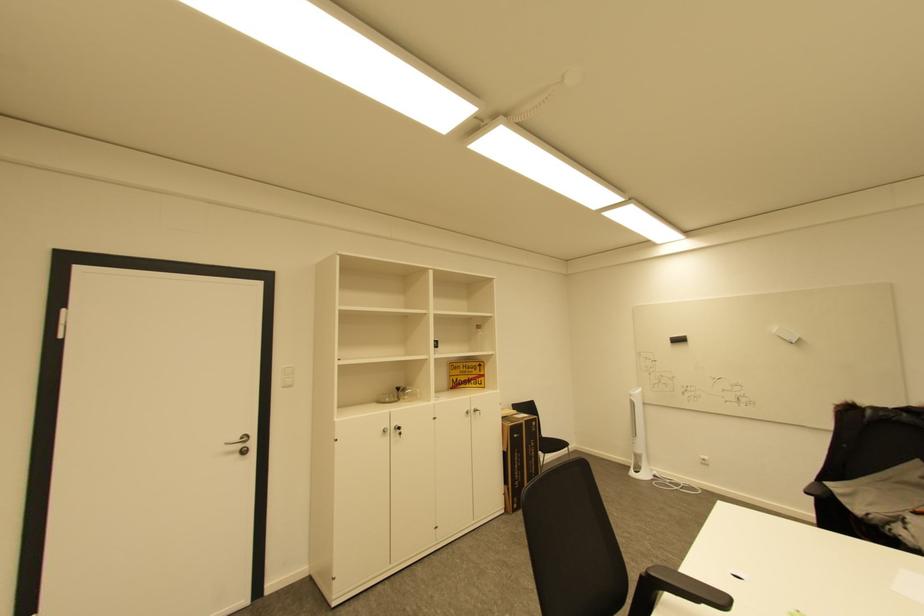
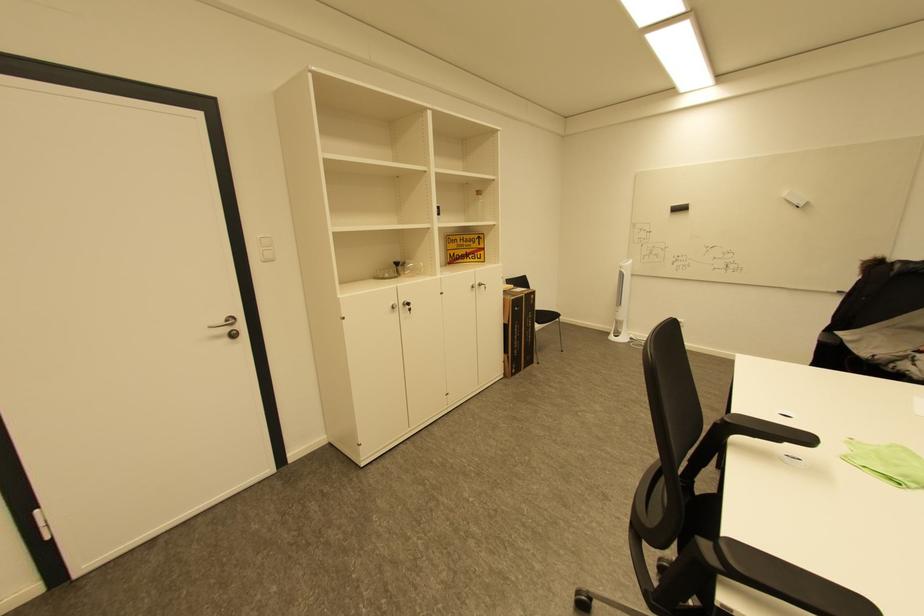
Where in the second image is the point corresponding to (289,387) from the first image?

(270, 261)